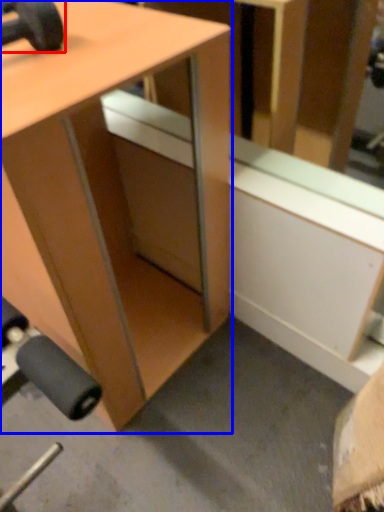
Question: Which of the following is the farthest to the observer, dumbbell (highlighted by a red box) or desk (highlighted by a blue box)?

Choices:
 (A) dumbbell
 (B) desk

Answer: (A)